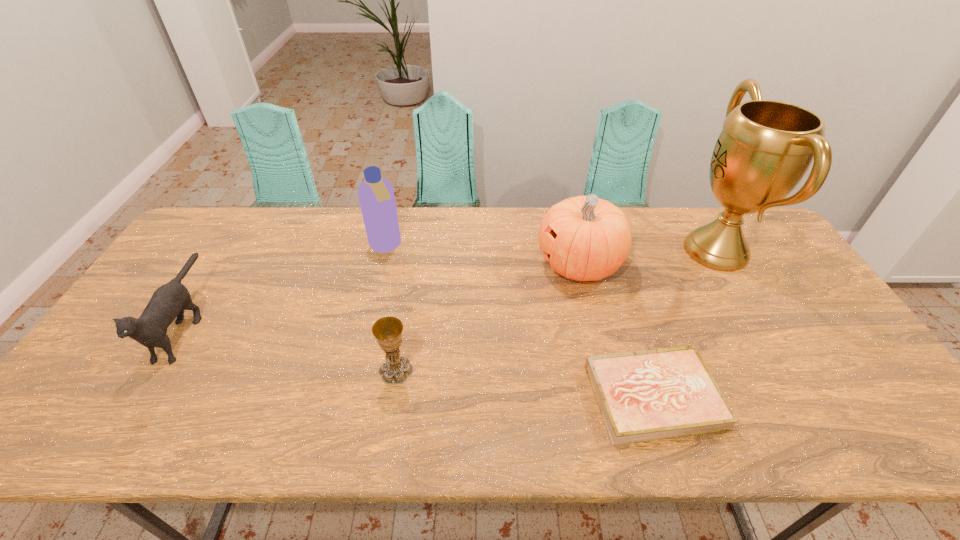
At what (x,y) coordinates should I click in order to perform the action: click on free region located 0.120m on the back of the second object from left to right. Please return your answer as a coordinate pair (x, y). Looking at the image, I should click on (394, 213).

Image resolution: width=960 pixels, height=540 pixels. I want to click on vacant region located on the front-facing side of the pumpkin, so click(x=443, y=264).

Where is `free location located on the front-facing side of the pumpkin`? free location located on the front-facing side of the pumpkin is located at coordinates (492, 264).

Where is `free region located 0.320m on the front-facing side of the pumpkin`? This screenshot has width=960, height=540. free region located 0.320m on the front-facing side of the pumpkin is located at coordinates (433, 264).

Find the location of a particular element. The image size is (960, 540). vacant space positioned on the front-facing side of the leftmost object is located at coordinates (126, 422).

Locate an element on the screen. The width and height of the screenshot is (960, 540). vacant space positioned 0.260m on the right of the chalice is located at coordinates (519, 370).

Locate an element on the screen. vacant space situated 0.140m on the left of the hardback book is located at coordinates (531, 397).

What are the coordinates of `trophy cup positioned at the far edge` in the screenshot? It's located at (765, 148).

Identify the location of shampoo situated at the far edge. (376, 196).

I want to click on pumpkin located in the far edge section of the desktop, so click(x=584, y=238).